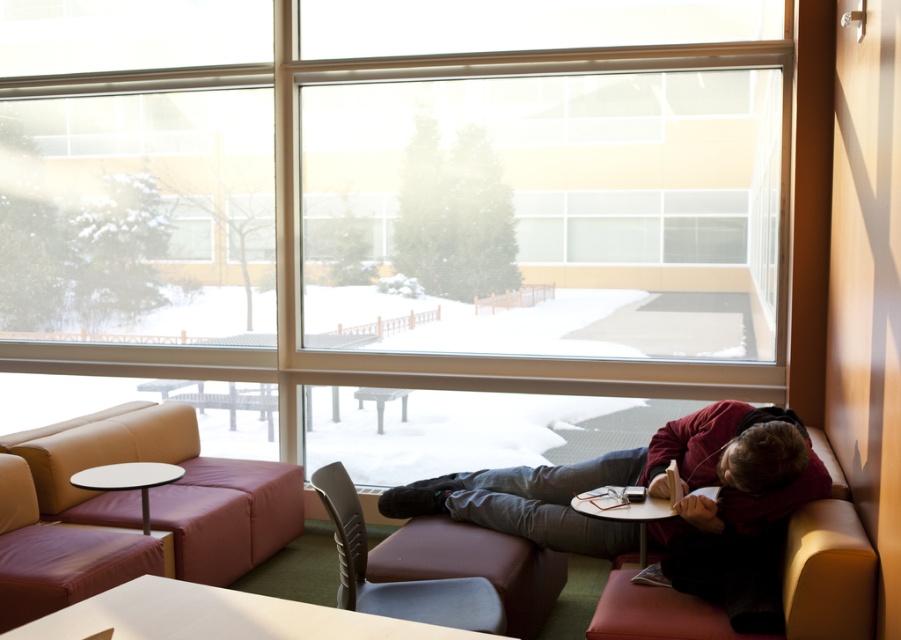
Is transparent glass window at center above white glossy table at lower center?

Indeed, transparent glass window at center is positioned over white glossy table at lower center.

Does transparent glass window at center have a smaller size compared to white glossy table at lower center?

No.

Locate an element on the screen. This screenshot has height=640, width=901. transparent glass window at center is located at coordinates (399, 225).

The height and width of the screenshot is (640, 901). Describe the element at coordinates (653, 520) in the screenshot. I see `maroon fleece jacket at lower right` at that location.

Can you confirm if maroon fleece jacket at lower right is smaller than gray fabric chair at center?

Incorrect, maroon fleece jacket at lower right is not smaller in size than gray fabric chair at center.

The height and width of the screenshot is (640, 901). What do you see at coordinates (653, 520) in the screenshot? I see `maroon fleece jacket at lower right` at bounding box center [653, 520].

The image size is (901, 640). What are the coordinates of `maroon fleece jacket at lower right` in the screenshot? It's located at (653, 520).

Which of these two, maroon fleece jacket at lower right or white glossy table at lower center, stands taller?

maroon fleece jacket at lower right is taller.

Based on the photo, which is below, maroon fleece jacket at lower right or white glossy table at lower center?

maroon fleece jacket at lower right is lower down.

Image resolution: width=901 pixels, height=640 pixels. What are the coordinates of `maroon fleece jacket at lower right` in the screenshot? It's located at (653, 520).